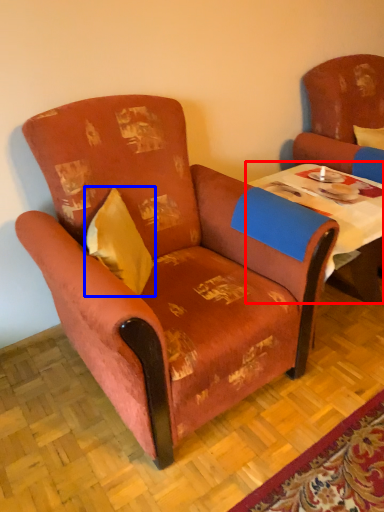
Question: Which point is closer to the camera, table (highlighted by a red box) or pillow (highlighted by a blue box)?

Choices:
 (A) table
 (B) pillow

Answer: (B)